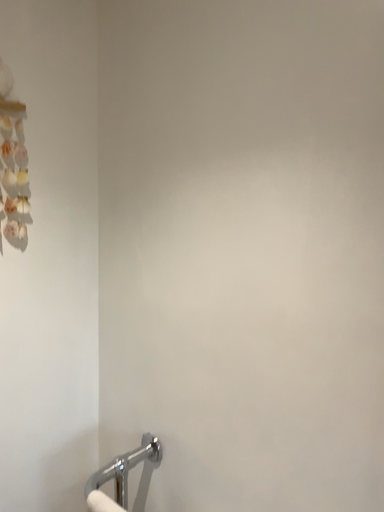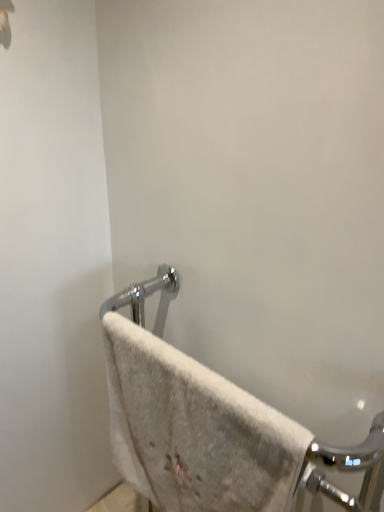
Question: Which way did the camera rotate in the video?

Choices:
 (A) rotated upward
 (B) rotated downward

Answer: (B)